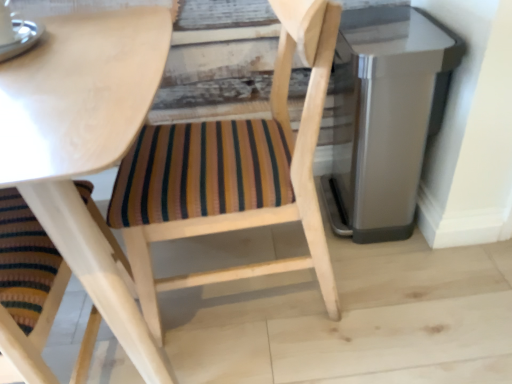
This screenshot has height=384, width=512. In order to click on vacant space in between wooden chair with striped cushion at center and satin silver trash can at right in this screenshot , I will do `click(377, 282)`.